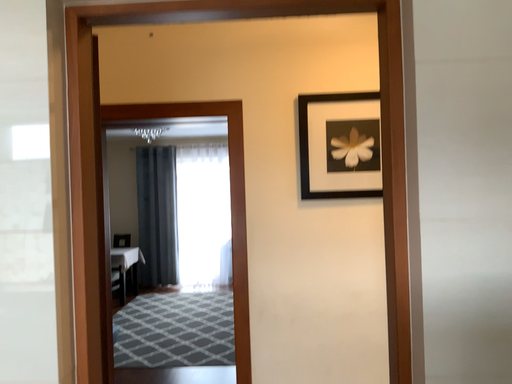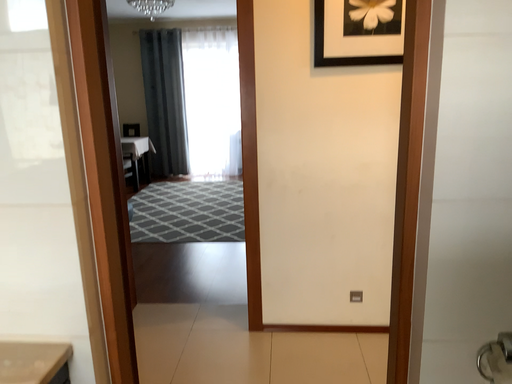
Question: Which way did the camera rotate in the video?

Choices:
 (A) rotated upward
 (B) rotated downward

Answer: (B)